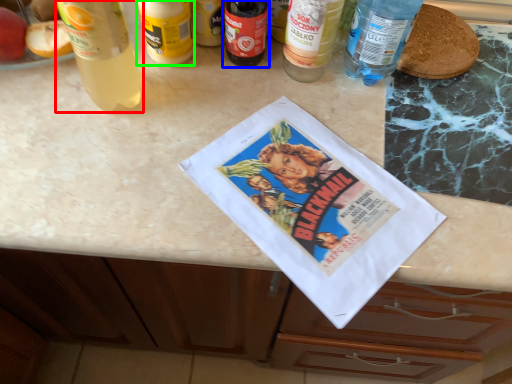
Question: Considering the real-world distances, which object is farthest from bottle (highlighted by a red box)? bottle (highlighted by a blue box) or bottle (highlighted by a green box)?

Choices:
 (A) bottle
 (B) bottle

Answer: (A)